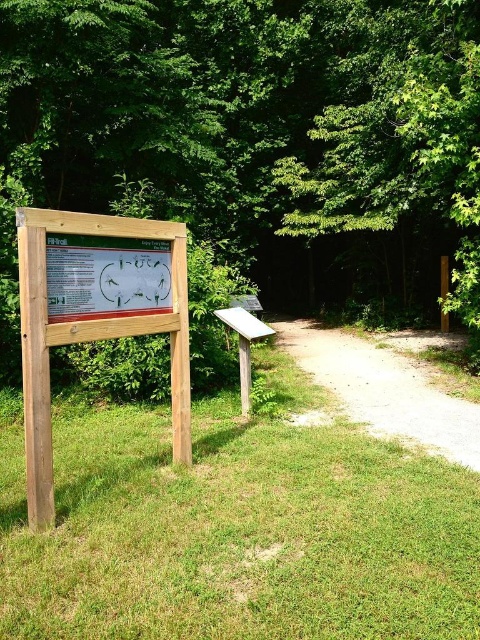
You are standing in the park and see the dirt path at center and the green wood sign at center. Which object is closer to you?

The dirt path at center is closer to you because it is further to the viewer than the green wood sign at center.

You are a hiker trying to decide whether to take the dirt path at center. From your current position, can you see the top of the green leafy tree at upper center?

The green leafy tree at upper center is much taller than the dirt path at center, so yes, you can see the top of the green leafy tree at upper center from your current position.

You are a hiker trying to follow the trail indicated by the green wood sign at center. You see a dirt path at center ahead. According to the sign, which direction should you turn to stay on the correct trail?

The dirt path at center is to the right of the green wood sign at center, so you should turn right to follow the correct trail indicated by the green wood sign at center.